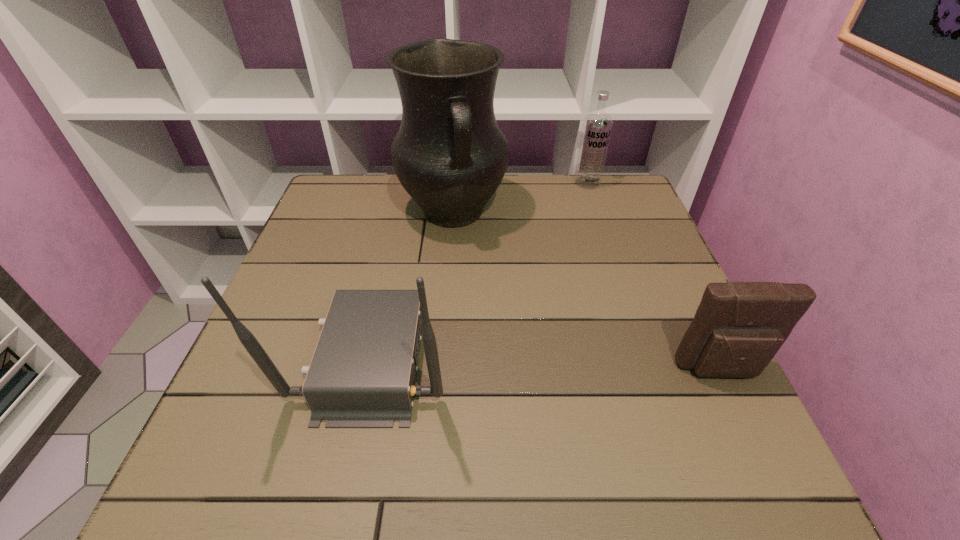
I want to click on object that is at the far right corner, so click(x=597, y=126).

This screenshot has width=960, height=540. In the image, there is a desktop. Identify the location of vacant area at the far edge. (559, 194).

Locate an element on the screen. free space at the left edge of the desktop is located at coordinates (322, 238).

In the image, there is a desktop. Identify the location of vacant space at the right edge. (658, 302).

I want to click on vacant region at the far left corner of the desktop, so click(x=372, y=183).

Where is `vacant space at the far right corner of the desktop`? vacant space at the far right corner of the desktop is located at coordinates (604, 219).

Find the location of a particular element. The height and width of the screenshot is (540, 960). free spot between the tallest object and the vodka is located at coordinates (520, 198).

This screenshot has width=960, height=540. Find the location of `vacant area that lies between the third tallest object and the second tallest object`. vacant area that lies between the third tallest object and the second tallest object is located at coordinates (481, 270).

You are a GUI agent. You are given a task and a screenshot of the screen. Output one action in this format:
    pyautogui.click(x=<x>, y=<y>)
    Task: Click on the unoccupied area between the router and the vodka
    The width and height of the screenshot is (960, 540).
    Given the screenshot: What is the action you would take?
    pyautogui.click(x=481, y=270)

Locate an element on the screen. The image size is (960, 540). vacant region between the router and the pitcher is located at coordinates (414, 285).